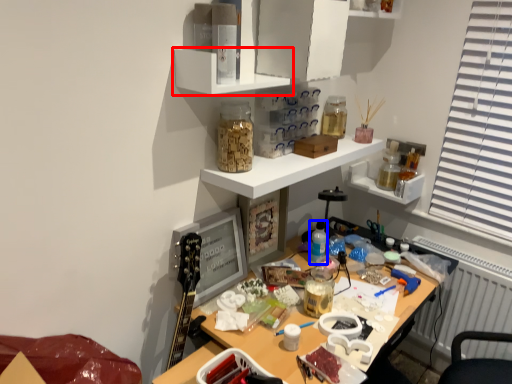
Question: Which of the following is the closest to the observer, shelf (highlighted by a red box) or bottle (highlighted by a blue box)?

Choices:
 (A) shelf
 (B) bottle

Answer: (A)